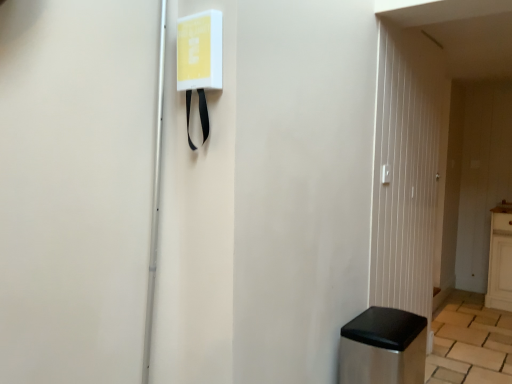
Question: From a real-world perspective, relative to stainless steel trash can at lower right, is white plastic light switch at upper right vertically above or below?

Choices:
 (A) below
 (B) above

Answer: (B)

Question: Does point (381, 175) appear closer or farther from the camera than point (406, 321)?

Choices:
 (A) farther
 (B) closer

Answer: (B)

Question: Which object is the closest to the white plastic light switch at upper right?

Choices:
 (A) stainless steel trash can at lower right
 (B) transparent glass door at right

Answer: (B)

Question: Which object is the farthest from the stainless steel trash can at lower right?

Choices:
 (A) transparent glass door at right
 (B) white plastic light switch at upper right

Answer: (B)